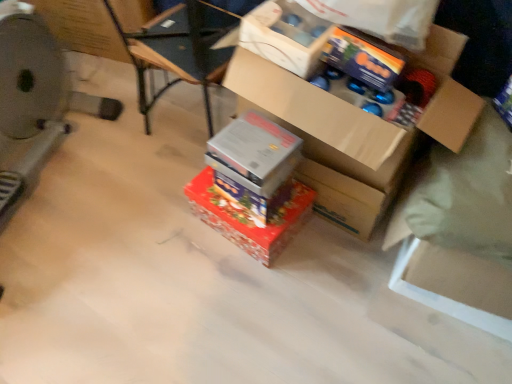
Locate an element on the screen. metallic silver box at center, the second box positioned from the top is located at coordinates (254, 153).

Measure the distance between metallic silver box at center, the second box positioned from the top, and camera.

metallic silver box at center, the second box positioned from the top, and camera are 4.04 feet apart.

Find the location of a particular element. This screenshot has height=384, width=512. shiny metallic box at center, positioned as the 3th box in top-to-bottom order is located at coordinates (248, 218).

What do you see at coordinates (83, 27) in the screenshot? The image size is (512, 384). I see `cardboard box at upper left` at bounding box center [83, 27].

The height and width of the screenshot is (384, 512). I want to click on cardboard box at upper center, so click(x=282, y=36).

The width and height of the screenshot is (512, 384). Find the location of `metallic silver box at center, the second box positioned from the top`. metallic silver box at center, the second box positioned from the top is located at coordinates (254, 153).

Does cardboard box at upper left lie in front of metallic silver box at center, the second box positioned from the top?

No.

From the picture: Would you say metallic silver box at center, which appears as the second box when ordered from the bottom, is part of cardboard box at upper left's contents?

No, cardboard box at upper left does not contain metallic silver box at center, which appears as the second box when ordered from the bottom.

From the image's perspective, who appears lower, cardboard box at upper left or metallic silver box at center, the second box positioned from the top?

From the image's view, metallic silver box at center, the second box positioned from the top, is below.

How different are the orientations of cardboard box at upper left and metallic silver box at center, the second box positioned from the top, in degrees?

There is a 15.9-degree angle between the facing directions of cardboard box at upper left and metallic silver box at center, the second box positioned from the top.

Which point is more distant from viewer, (284, 64) or (56, 10)?

The point (56, 10) is behind.

Can you confirm if cardboard box at upper center is thinner than cardboard box at upper left?

Indeed, cardboard box at upper center has a lesser width compared to cardboard box at upper left.

Locate an element on the screen. storage box in front of the cardboard box at upper left is located at coordinates (282, 36).

Which is in front, cardboard box at upper center or cardboard box at upper left?

cardboard box at upper center.

Locate an element on the screen. The width and height of the screenshot is (512, 384). storage box on the left of shiny orange wrapping paper at upper center is located at coordinates (282, 36).

From the image's perspective, does cardboard box at upper center appear higher than shiny orange wrapping paper at upper center?

Incorrect, from the image's perspective, cardboard box at upper center is lower than shiny orange wrapping paper at upper center.

From a real-world perspective, is cardboard box at upper center positioned above or below shiny orange wrapping paper at upper center?

Clearly, from a real-world perspective, cardboard box at upper center is below shiny orange wrapping paper at upper center.

Which is more to the left, shiny metallic box at center, positioned as the 3th box in top-to-bottom order, or cardboard box at upper center?

Positioned to the left is shiny metallic box at center, positioned as the 3th box in top-to-bottom order.

Locate an element on the screen. The height and width of the screenshot is (384, 512). box that is the 3rd object located below the cardboard box at upper center (from the image's perspective) is located at coordinates (248, 218).

From the image's perspective, which object appears higher, shiny metallic box at center, the first box in the bottom-to-top sequence, or cardboard box at upper center?

cardboard box at upper center appears higher in the image.

Is shiny metallic box at center, the first box in the bottom-to-top sequence, positioned with its back to cardboard box at upper center?

No, shiny metallic box at center, the first box in the bottom-to-top sequence, is not facing the opposite direction of cardboard box at upper center.

Looking at the image, does cardboard box at center, which appears as the 1th box when viewed from the top, seem bigger or smaller compared to metallic silver exercise machine at left?

Clearly, cardboard box at center, which appears as the 1th box when viewed from the top, is smaller in size than metallic silver exercise machine at left.

Who is shorter, cardboard box at center, which appears as the 1th box when viewed from the top, or metallic silver exercise machine at left?

cardboard box at center, which appears as the 1th box when viewed from the top.

Is cardboard box at center, positioned as the third box in bottom-to-top order, inside the boundaries of metallic silver exercise machine at left, or outside?

cardboard box at center, positioned as the third box in bottom-to-top order, is not inside metallic silver exercise machine at left, it's outside.

Identify the location of box above the metallic silver exercise machine at left (from the image's perspective). (328, 141).

In the scene shown: Which point is more forward, (359, 159) or (69, 9)?

The point (359, 159) is closer to the camera.

Is cardboard box at center, positioned as the third box in bottom-to-top order, far from cardboard box at upper left?

That's right, there is a large distance between cardboard box at center, positioned as the third box in bottom-to-top order, and cardboard box at upper left.

You are a GUI agent. You are given a task and a screenshot of the screen. Output one action in this format:
    pyautogui.click(x=<x>, y=<y>)
    Task: Click on the cardboard box on the left side of cardboard box at center, which appears as the 1th box when viewed from the top
    
    Given the screenshot: What is the action you would take?
    pyautogui.click(x=83, y=27)

What's the angular difference between cardboard box at center, which appears as the 1th box when viewed from the top, and cardboard box at upper left's facing directions?

The angle between the facing direction of cardboard box at center, which appears as the 1th box when viewed from the top, and the facing direction of cardboard box at upper left is 17.3 degrees.

Consider the image. Can you see metallic silver exercise machine at left touching cardboard box at upper center?

No, metallic silver exercise machine at left is not in contact with cardboard box at upper center.

Which is more to the right, metallic silver exercise machine at left or cardboard box at upper center?

cardboard box at upper center.

Who is smaller, metallic silver exercise machine at left or cardboard box at upper center?

cardboard box at upper center.

Between metallic silver exercise machine at left and cardboard box at upper center, which one has larger width?

metallic silver exercise machine at left.

Where is `the 2nd box in front of the cardboard box at upper left, counting from the anchor's position`? The image size is (512, 384). the 2nd box in front of the cardboard box at upper left, counting from the anchor's position is located at coordinates (254, 153).

You are a GUI agent. You are given a task and a screenshot of the screen. Output one action in this format:
    pyautogui.click(x=<x>, y=<y>)
    Task: Click on the cardboard box directly beneath the cardboard box at upper center (from a real-world perspective)
    This screenshot has height=384, width=512.
    Given the screenshot: What is the action you would take?
    pyautogui.click(x=83, y=27)

Based on the photo, from the image, which object appears to be nearer to metallic silver exercise machine at left, cardboard box at center, which appears as the 1th box when viewed from the top, or cardboard box at upper left?

Among the two, cardboard box at upper left is located nearer to metallic silver exercise machine at left.

Estimate the real-world distances between objects in this image. Which object is further from shiny orange wrapping paper at upper center, metallic silver exercise machine at left or metallic silver box at center, which appears as the second box when ordered from the bottom?

metallic silver exercise machine at left is further to shiny orange wrapping paper at upper center.

From the image, which object appears to be farther from cardboard box at upper left, cardboard box at center, which appears as the 1th box when viewed from the top, or shiny metallic box at center, the first box in the bottom-to-top sequence?

Among the two, cardboard box at center, which appears as the 1th box when viewed from the top, is located further to cardboard box at upper left.

From the image, which object appears to be farther from cardboard box at upper center, cardboard box at upper left or cardboard box at center, positioned as the third box in bottom-to-top order?

cardboard box at upper left lies further to cardboard box at upper center than the other object.

In the scene shown: Looking at the image, which one is located further to metallic silver exercise machine at left, metallic silver box at center, the second box positioned from the top, or shiny metallic box at center, positioned as the 3th box in top-to-bottom order?

metallic silver box at center, the second box positioned from the top.

Considering their positions, is cardboard box at upper left positioned closer to metallic silver exercise machine at left than metallic silver box at center, the second box positioned from the top?

Based on the image, cardboard box at upper left appears to be nearer to metallic silver exercise machine at left.

Based on their spatial positions, is shiny metallic box at center, positioned as the 3th box in top-to-bottom order, or metallic silver box at center, which appears as the second box when ordered from the bottom, closer to cardboard box at upper center?

metallic silver box at center, which appears as the second box when ordered from the bottom, is positioned closer to the anchor cardboard box at upper center.

Estimate the real-world distances between objects in this image. Which object is further from metallic silver box at center, which appears as the second box when ordered from the bottom, cardboard box at upper center or metallic silver exercise machine at left?

metallic silver exercise machine at left is further to metallic silver box at center, which appears as the second box when ordered from the bottom.

Identify the location of storage box between metallic silver exercise machine at left and shiny orange wrapping paper at upper center in the horizontal direction. Image resolution: width=512 pixels, height=384 pixels. tap(282, 36).

Locate an element on the screen. This screenshot has width=512, height=384. box between metallic silver exercise machine at left and metallic silver box at center, which appears as the second box when ordered from the bottom is located at coordinates (248, 218).

The image size is (512, 384). I want to click on cardboard box situated between metallic silver exercise machine at left and cardboard box at upper center from left to right, so click(83, 27).

Find the location of a particular element. wide between cardboard box at upper left and shiny metallic box at center, positioned as the 3th box in top-to-bottom order, in the up-down direction is located at coordinates [x=34, y=102].